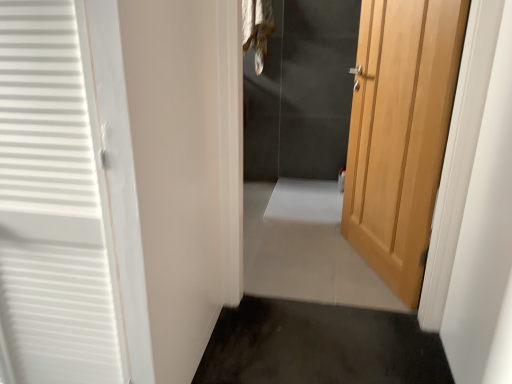
Where is `light wood door at right`? The image size is (512, 384). light wood door at right is located at coordinates (400, 133).

What is the approximate width of white tile floor at center, the 2th path viewed from the front?

white tile floor at center, the 2th path viewed from the front, is 1.69 meters wide.

Where is `light wood door at right`? This screenshot has height=384, width=512. light wood door at right is located at coordinates (400, 133).

From the image's perspective, would you say fur-like fabric at upper center is shown under light wood door at right?

Incorrect, from the image's perspective, fur-like fabric at upper center is higher than light wood door at right.

Considering the relative sizes of fur-like fabric at upper center and light wood door at right in the image provided, is fur-like fabric at upper center taller than light wood door at right?

In fact, fur-like fabric at upper center may be shorter than light wood door at right.

What's the angular difference between fur-like fabric at upper center and light wood door at right's facing directions?

67 degrees.

From the picture: Is fur-like fabric at upper center behind light wood door at right?

Yes, the depth of fur-like fabric at upper center is greater than that of light wood door at right.

How far apart are light wood door at right and fur-like fabric at upper center?

The distance of light wood door at right from fur-like fabric at upper center is 4.70 feet.

Can you tell me how much light wood door at right and fur-like fabric at upper center differ in facing direction?

light wood door at right and fur-like fabric at upper center are facing 67 degrees away from each other.

Locate an element on the screen. This screenshot has height=384, width=512. laundry above the light wood door at right (from the image's perspective) is located at coordinates (257, 29).

From a real-world perspective, which object stands above the other?

fur-like fabric at upper center, from a real-world perspective.

Is white tile floor at center, which appears as the 2th path when ordered from the bottom, with fur-like fabric at upper center?

No, white tile floor at center, which appears as the 2th path when ordered from the bottom, is not in contact with fur-like fabric at upper center.

Is white tile floor at center, which appears as the 2th path when ordered from the bottom, in front of fur-like fabric at upper center?

Yes, white tile floor at center, which appears as the 2th path when ordered from the bottom, is closer to the viewer.

Is white tile floor at center, the 1th path when ordered from back to front, to the left of fur-like fabric at upper center from the viewer's perspective?

In fact, white tile floor at center, the 1th path when ordered from back to front, is to the right of fur-like fabric at upper center.

From a real-world perspective, which is physically below, white tile floor at center, arranged as the 1th path when viewed from the top, or fur-like fabric at upper center?

white tile floor at center, arranged as the 1th path when viewed from the top.

Considering the relative positions of light wood door at right and dark gray carpet at lower center, acting as the second path starting from the back, in the image provided, is light wood door at right to the left or to the right of dark gray carpet at lower center, acting as the second path starting from the back,?

light wood door at right is to the right of dark gray carpet at lower center, acting as the second path starting from the back.

Is light wood door at right taller than dark gray carpet at lower center, which ranks as the 2th path in top-to-bottom order?

Indeed, light wood door at right has a greater height compared to dark gray carpet at lower center, which ranks as the 2th path in top-to-bottom order.

Considering the relative positions of light wood door at right and dark gray carpet at lower center, the first path from the front, in the image provided, is light wood door at right behind dark gray carpet at lower center, the first path from the front,?

That is True.

Are light wood door at right and dark gray carpet at lower center, which ranks as the 2th path in top-to-bottom order, making contact?

light wood door at right and dark gray carpet at lower center, which ranks as the 2th path in top-to-bottom order, are clearly separated.

Is dark gray carpet at lower center, the first path from the bottom, located outside white tile floor at center, the 2th path viewed from the front?

Yes, dark gray carpet at lower center, the first path from the bottom, is located beyond the bounds of white tile floor at center, the 2th path viewed from the front.

Which object is wider, dark gray carpet at lower center, the first path from the front, or white tile floor at center, arranged as the 1th path when viewed from the top?

white tile floor at center, arranged as the 1th path when viewed from the top, is wider.

Considering the sizes of dark gray carpet at lower center, the first path from the front, and white tile floor at center, which appears as the 2th path when ordered from the bottom, in the image, is dark gray carpet at lower center, the first path from the front, taller or shorter than white tile floor at center, which appears as the 2th path when ordered from the bottom,?

In the image, dark gray carpet at lower center, the first path from the front, appears to be taller than white tile floor at center, which appears as the 2th path when ordered from the bottom.

From their relative heights in the image, would you say light wood door at right is taller or shorter than white tile floor at center, which appears as the 2th path when ordered from the bottom?

Clearly, light wood door at right is taller compared to white tile floor at center, which appears as the 2th path when ordered from the bottom.

From a real-world perspective, is light wood door at right physically located above or below white tile floor at center, which appears as the 2th path when ordered from the bottom?

Clearly, from a real-world perspective, light wood door at right is above white tile floor at center, which appears as the 2th path when ordered from the bottom.

Does light wood door at right touch white tile floor at center, which appears as the 2th path when ordered from the bottom?

They are not placed beside each other.

Which point is more forward, (296, 317) or (407, 217)?

The point (407, 217) is more forward.

Is dark gray carpet at lower center, acting as the second path starting from the back, to the left of light wood door at right from the viewer's perspective?

Yes.

From a real-world perspective, is dark gray carpet at lower center, which ranks as the 2th path in top-to-bottom order, physically located above or below light wood door at right?

From a real-world perspective, dark gray carpet at lower center, which ranks as the 2th path in top-to-bottom order, is physically below light wood door at right.

Is dark gray carpet at lower center, the first path from the bottom, touching light wood door at right?

They are not placed beside each other.

Locate an element on the screen. The width and height of the screenshot is (512, 384). door below the fur-like fabric at upper center (from the image's perspective) is located at coordinates (400, 133).

Locate an element on the screen. door in front of the fur-like fabric at upper center is located at coordinates (400, 133).

Considering their positions, is fur-like fabric at upper center positioned further to white tile floor at center, which appears as the 2th path when ordered from the bottom, than light wood door at right?

fur-like fabric at upper center is further to white tile floor at center, which appears as the 2th path when ordered from the bottom.

Considering their positions, is light wood door at right positioned closer to dark gray carpet at lower center, acting as the second path starting from the back, than fur-like fabric at upper center?

light wood door at right is positioned closer to the anchor dark gray carpet at lower center, acting as the second path starting from the back.

Looking at the image, which one is located further to fur-like fabric at upper center, light wood door at right or white tile floor at center, arranged as the 1th path when viewed from the top?

The object further to fur-like fabric at upper center is light wood door at right.

Which object lies nearer to the anchor point fur-like fabric at upper center, white tile floor at center, the 2th path viewed from the front, or dark gray carpet at lower center, acting as the second path starting from the back?

The object closer to fur-like fabric at upper center is white tile floor at center, the 2th path viewed from the front.

Based on the photo, looking at the image, which one is located closer to light wood door at right, fur-like fabric at upper center or white tile floor at center, arranged as the 1th path when viewed from the top?

The object closer to light wood door at right is white tile floor at center, arranged as the 1th path when viewed from the top.

Estimate the real-world distances between objects in this image. Which object is further from fur-like fabric at upper center, dark gray carpet at lower center, acting as the second path starting from the back, or white tile floor at center, the 2th path viewed from the front?

dark gray carpet at lower center, acting as the second path starting from the back, lies further to fur-like fabric at upper center than the other object.

Which object lies further to the anchor point light wood door at right, fur-like fabric at upper center or dark gray carpet at lower center, the first path from the bottom?

fur-like fabric at upper center lies further to light wood door at right than the other object.

Which object lies nearer to the anchor point light wood door at right, dark gray carpet at lower center, the first path from the front, or white tile floor at center, which appears as the 2th path when ordered from the bottom?

Among the two, white tile floor at center, which appears as the 2th path when ordered from the bottom, is located nearer to light wood door at right.

What are the coordinates of `path between light wood door at right and fur-like fabric at upper center along the z-axis` in the screenshot? It's located at (305, 249).

The image size is (512, 384). Find the location of `path between fur-like fabric at upper center and dark gray carpet at lower center, acting as the second path starting from the back, from top to bottom`. path between fur-like fabric at upper center and dark gray carpet at lower center, acting as the second path starting from the back, from top to bottom is located at coordinates (305, 249).

The width and height of the screenshot is (512, 384). I want to click on path that lies between light wood door at right and dark gray carpet at lower center, the first path from the front, from top to bottom, so click(x=305, y=249).

Find the location of a particular element. Image resolution: width=512 pixels, height=384 pixels. door between dark gray carpet at lower center, acting as the second path starting from the back, and fur-like fabric at upper center, along the z-axis is located at coordinates (400, 133).